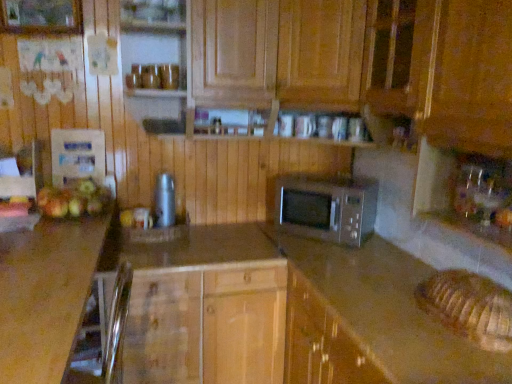
Measure the distance between brushed metal thermos at center and camera.

A distance of 7.09 feet exists between brushed metal thermos at center and camera.

The image size is (512, 384). I want to click on brushed metal thermos at center, so click(x=164, y=201).

In order to face green matte apple at left, the 1th apple positioned from the back, should I rotate leftwards or rightwards?

→ Turn left approximately 16.932 degrees to face it.

The height and width of the screenshot is (384, 512). What are the coordinates of `silver metallic microwave at center` in the screenshot? It's located at (327, 207).

Identify the location of shiny golden apples at left, the second apple from the bottom. (74, 200).

Where is `smooth granite countertop at center, which ranks as the first countertop in right-to-left order`? smooth granite countertop at center, which ranks as the first countertop in right-to-left order is located at coordinates (334, 295).

What are the coordinates of `brushed metal thermos at center` in the screenshot? It's located at (164, 201).

Which of these two, brown laminate counter at center or brown laminate countertop at lower left, acting as the second countertop starting from the right, stands shorter?

With less height is brown laminate counter at center.

Is brown laminate counter at center with brown laminate countertop at lower left, acting as the second countertop starting from the right?

No, brown laminate counter at center is not touching brown laminate countertop at lower left, acting as the second countertop starting from the right.

Can you confirm if brown laminate counter at center is positioned to the left of brown laminate countertop at lower left, placed as the first countertop when sorted from left to right?

Incorrect, brown laminate counter at center is not on the left side of brown laminate countertop at lower left, placed as the first countertop when sorted from left to right.

How far apart are brown laminate counter at center and brown laminate countertop at lower left, placed as the first countertop when sorted from left to right?

brown laminate counter at center and brown laminate countertop at lower left, placed as the first countertop when sorted from left to right, are 37.80 inches apart.

This screenshot has height=384, width=512. I want to click on cabinetry on the left of brown laminate counter at center, so click(x=204, y=306).

In the scene shown: Would you say brown laminate counter at center is inside or outside wooden cabinet at center?

brown laminate counter at center is spatially situated outside wooden cabinet at center.

Is brown laminate counter at center thinner than wooden cabinet at center?

In fact, brown laminate counter at center might be wider than wooden cabinet at center.

Is brown laminate counter at center positioned with its back to wooden cabinet at center?

No, brown laminate counter at center's orientation is not away from wooden cabinet at center.

Is transparent glass sink at right situated inside smooth granite countertop at center, which is counted as the second countertop, starting from the left, or outside?

transparent glass sink at right is located beyond the bounds of smooth granite countertop at center, which is counted as the second countertop, starting from the left.

Looking at this image, is smooth granite countertop at center, which ranks as the first countertop in right-to-left order, at the back of transparent glass sink at right?

No.

Does transparent glass sink at right touch smooth granite countertop at center, which is counted as the second countertop, starting from the left?

No, transparent glass sink at right is not beside smooth granite countertop at center, which is counted as the second countertop, starting from the left.

Where is `sink behind the smooth granite countertop at center, which ranks as the first countertop in right-to-left order`? This screenshot has width=512, height=384. sink behind the smooth granite countertop at center, which ranks as the first countertop in right-to-left order is located at coordinates (480, 193).

Does wooden cabinet at center have a greater width compared to silver metallic microwave at center?

Correct, the width of wooden cabinet at center exceeds that of silver metallic microwave at center.

Considering the relative sizes of wooden cabinet at center and silver metallic microwave at center in the image provided, is wooden cabinet at center bigger than silver metallic microwave at center?

Correct, wooden cabinet at center is larger in size than silver metallic microwave at center.

Which is more to the right, wooden cabinet at center or silver metallic microwave at center?

From the viewer's perspective, silver metallic microwave at center appears more on the right side.

Considering the sizes of objects transparent glass sink at right and brown laminate counter at center in the image provided, who is bigger, transparent glass sink at right or brown laminate counter at center?

brown laminate counter at center.

Considering the sizes of objects transparent glass sink at right and brown laminate counter at center in the image provided, who is taller, transparent glass sink at right or brown laminate counter at center?

Standing taller between the two is brown laminate counter at center.

Between point (475, 164) and point (353, 299), which one is positioned in front?

The point (475, 164) is closer to the camera.

Can you confirm if transparent glass sink at right is positioned to the right of brown laminate counter at center?

Yes, transparent glass sink at right is to the right of brown laminate counter at center.

Do you think shiny golden apples at left, which is counted as the first apple, starting from the front, is within wooden cabinet at center, or outside of it?

shiny golden apples at left, which is counted as the first apple, starting from the front, is located beyond the bounds of wooden cabinet at center.

Which of these two, shiny golden apples at left, which is counted as the 2th apple, starting from the back, or wooden cabinet at center, is smaller?

shiny golden apples at left, which is counted as the 2th apple, starting from the back.

Looking at this image, is shiny golden apples at left, which is counted as the first apple, starting from the front, in front of or behind wooden cabinet at center in the image?

shiny golden apples at left, which is counted as the first apple, starting from the front, is behind wooden cabinet at center.

Is point (90, 193) closer to viewer compared to point (217, 359)?

Yes.

Locate an element on the screen. sink behind the brown laminate counter at center is located at coordinates (480, 193).

Is point (441, 371) positioned before point (510, 190)?

Yes, point (441, 371) is in front of point (510, 190).

From a real-world perspective, which object stands above the other?

From a 3D spatial view, transparent glass sink at right is above.

Locate an element on the screen. This screenshot has width=512, height=384. counter below the brown laminate countertop at lower left, acting as the second countertop starting from the right (from a real-world perspective) is located at coordinates (370, 320).

You are a GUI agent. You are given a task and a screenshot of the screen. Output one action in this format:
    pyautogui.click(x=<x>, y=<y>)
    Task: Click on the cabinetry above the brown laminate counter at center (from a real-world perspective)
    The image size is (512, 384).
    Given the screenshot: What is the action you would take?
    pyautogui.click(x=204, y=306)

From the picture: Based on their spatial positions, is brown laminate counter at center or brushed metal thermos at center further from shiny golden apples at left, arranged as the 1th apple when viewed from the top?

brown laminate counter at center.

Estimate the real-world distances between objects in this image. Which object is closer to brown laminate countertop at lower left, acting as the second countertop starting from the right, silver metallic microwave at center or transparent glass sink at right?

Based on the image, silver metallic microwave at center appears to be nearer to brown laminate countertop at lower left, acting as the second countertop starting from the right.

Based on their spatial positions, is green matte apple at left, the second apple in the front-to-back sequence, or brown laminate countertop at lower left, placed as the first countertop when sorted from left to right, closer to smooth granite countertop at center, which is counted as the second countertop, starting from the left?

The object closer to smooth granite countertop at center, which is counted as the second countertop, starting from the left, is brown laminate countertop at lower left, placed as the first countertop when sorted from left to right.

Estimate the real-world distances between objects in this image. Which object is closer to wooden cabinet at center, green matte apple at left, the 1th apple ordered from the bottom, or brown laminate countertop at lower left, placed as the first countertop when sorted from left to right?

brown laminate countertop at lower left, placed as the first countertop when sorted from left to right, lies closer to wooden cabinet at center than the other object.

In the scene shown: Based on their spatial positions, is brown laminate countertop at lower left, acting as the second countertop starting from the right, or brushed metal thermos at center closer to silver metallic microwave at center?

The object closer to silver metallic microwave at center is brushed metal thermos at center.

Estimate the real-world distances between objects in this image. Which object is closer to brushed metal thermos at center, brown laminate counter at center or wooden cabinet at center?

The object closer to brushed metal thermos at center is wooden cabinet at center.

Based on their spatial positions, is smooth granite countertop at center, which is counted as the second countertop, starting from the left, or shiny golden apples at left, the second apple from the bottom, further from wooden cabinet at center?

Among the two, shiny golden apples at left, the second apple from the bottom, is located further to wooden cabinet at center.

Estimate the real-world distances between objects in this image. Which object is further from brushed metal thermos at center, wooden cabinet at center or brown laminate counter at center?

Among the two, brown laminate counter at center is located further to brushed metal thermos at center.

Locate an element on the screen. This screenshot has width=512, height=384. countertop between brown laminate countertop at lower left, placed as the first countertop when sorted from left to right, and green matte apple at left, placed as the second apple when sorted from top to bottom, in the front-back direction is located at coordinates pyautogui.click(x=334, y=295).

At what (x,y) coordinates should I click in order to perform the action: click on apple between smooth granite countertop at center, which ranks as the first countertop in right-to-left order, and green matte apple at left, the second apple in the front-to-back sequence, along the z-axis. Please return your answer as a coordinate pair (x, y). The height and width of the screenshot is (384, 512). Looking at the image, I should click on (74, 200).

Locate an element on the screen. apple between shiny golden apples at left, which is counted as the 2th apple, starting from the back, and wooden cabinet at center vertically is located at coordinates (127, 218).

Identify the location of counter positioned between smooth granite countertop at center, which is counted as the second countertop, starting from the left, and wooden cabinet at center from near to far. The width and height of the screenshot is (512, 384). (370, 320).